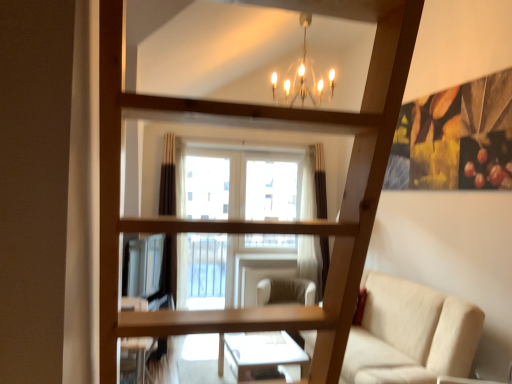
Image resolution: width=512 pixels, height=384 pixels. What are the coordinates of `beige fabric swivel chair at center` in the screenshot? It's located at (286, 291).

What do you see at coordinates (286, 291) in the screenshot? I see `beige fabric swivel chair at center` at bounding box center [286, 291].

The height and width of the screenshot is (384, 512). Describe the element at coordinates (410, 334) in the screenshot. I see `beige fabric couch at lower right` at that location.

Locate an element on the screen. beige fabric couch at lower right is located at coordinates (410, 334).

Measure the distance between point (468,323) and camera.

Point (468,323) is 3.07 meters from camera.

Locate an element on the screen. Image resolution: width=512 pixels, height=384 pixels. beige fabric swivel chair at center is located at coordinates point(286,291).

Considering the relative positions of beige fabric couch at lower right and beige fabric swivel chair at center in the image provided, is beige fabric couch at lower right to the left of beige fabric swivel chair at center from the viewer's perspective?

No.

Considering their positions, is beige fabric couch at lower right located in front of or behind beige fabric swivel chair at center?

beige fabric couch at lower right is positioned closer to the viewer than beige fabric swivel chair at center.

Which point is more distant from viewer, (x=400, y=354) or (x=288, y=285)?

Positioned behind is point (x=288, y=285).

From the image's perspective, which one is positioned higher, beige fabric couch at lower right or beige fabric swivel chair at center?

From the image's view, beige fabric couch at lower right is above.

Consider the image. From a real-world perspective, is beige fabric couch at lower right on top of beige fabric swivel chair at center?

Correct, in the physical world, beige fabric couch at lower right is higher than beige fabric swivel chair at center.

Can you confirm if beige fabric couch at lower right is thinner than beige fabric swivel chair at center?

Incorrect, the width of beige fabric couch at lower right is not less than that of beige fabric swivel chair at center.

Considering the sizes of beige fabric couch at lower right and beige fabric swivel chair at center in the image, is beige fabric couch at lower right taller or shorter than beige fabric swivel chair at center?

In the image, beige fabric couch at lower right appears to be taller than beige fabric swivel chair at center.

Does beige fabric couch at lower right have a larger size compared to beige fabric swivel chair at center?

Yes, beige fabric couch at lower right is bigger than beige fabric swivel chair at center.

Would you say beige fabric couch at lower right contains beige fabric swivel chair at center?

No, beige fabric swivel chair at center is not inside beige fabric couch at lower right.

Are beige fabric couch at lower right and beige fabric swivel chair at center making contact?

They are not placed beside each other.

Is beige fabric couch at lower right oriented towards beige fabric swivel chair at center?

No.

Can you tell me how much beige fabric couch at lower right and beige fabric swivel chair at center differ in facing direction?

The angular difference between beige fabric couch at lower right and beige fabric swivel chair at center is 62.3 degrees.

Identify the location of swivel chair below the beige fabric couch at lower right (from a real-world perspective). (286, 291).

Considering the positions of objects beige fabric swivel chair at center and beige fabric couch at lower right in the image provided, who is more to the right, beige fabric swivel chair at center or beige fabric couch at lower right?

From the viewer's perspective, beige fabric couch at lower right appears more on the right side.

Is beige fabric swivel chair at center behind beige fabric couch at lower right?

Yes, beige fabric swivel chair at center is behind beige fabric couch at lower right.

Is point (291, 284) behind point (390, 281)?

Yes, it is behind point (390, 281).

From the image's perspective, which object appears higher, beige fabric swivel chair at center or beige fabric couch at lower right?

beige fabric couch at lower right.

Based on the photo, from a real-world perspective, is beige fabric swivel chair at center above or below beige fabric couch at lower right?

beige fabric swivel chair at center is below beige fabric couch at lower right.

Can you confirm if beige fabric swivel chair at center is wider than beige fabric couch at lower right?

No, beige fabric swivel chair at center is not wider than beige fabric couch at lower right.

From the picture: Considering the sizes of beige fabric swivel chair at center and beige fabric couch at lower right in the image, is beige fabric swivel chair at center taller or shorter than beige fabric couch at lower right?

beige fabric swivel chair at center is shorter than beige fabric couch at lower right.

Based on their sizes in the image, would you say beige fabric swivel chair at center is bigger or smaller than beige fabric couch at lower right?

In the image, beige fabric swivel chair at center appears to be smaller than beige fabric couch at lower right.

Looking at this image, is beige fabric swivel chair at center not inside beige fabric couch at lower right?

Indeed, beige fabric swivel chair at center is completely outside beige fabric couch at lower right.

Would you say beige fabric swivel chair at center is a long distance from beige fabric couch at lower right?

beige fabric swivel chair at center is far away from beige fabric couch at lower right.

Could you tell me if beige fabric swivel chair at center is facing beige fabric couch at lower right?

No, beige fabric swivel chair at center is not facing towards beige fabric couch at lower right.

How different are the orientations of beige fabric swivel chair at center and beige fabric couch at lower right in degrees?

62.3 degrees separate the facing orientations of beige fabric swivel chair at center and beige fabric couch at lower right.

The width and height of the screenshot is (512, 384). In order to click on swivel chair below the beige fabric couch at lower right (from the image's perspective) in this screenshot , I will do `click(286, 291)`.

The height and width of the screenshot is (384, 512). Find the location of `swivel chair below the beige fabric couch at lower right (from the image's perspective)`. swivel chair below the beige fabric couch at lower right (from the image's perspective) is located at coordinates (286, 291).

Locate an element on the screen. This screenshot has width=512, height=384. studio couch above the beige fabric swivel chair at center (from the image's perspective) is located at coordinates (410, 334).